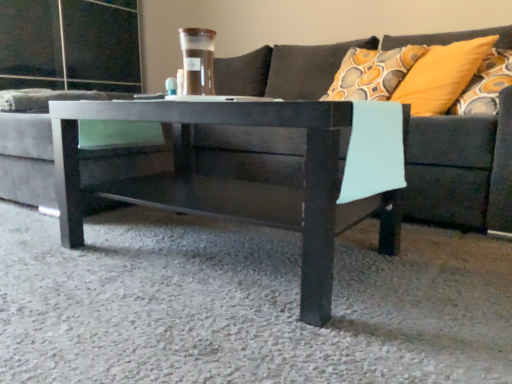
Question: Is yellow fabric pillow at upper right turned away from matte black coffee table at center?

Choices:
 (A) no
 (B) yes

Answer: (A)

Question: Is yellow fabric pillow at upper right further to camera compared to matte black coffee table at center?

Choices:
 (A) yes
 (B) no

Answer: (A)

Question: Can you confirm if yellow fabric pillow at upper right is bigger than matte black coffee table at center?

Choices:
 (A) no
 (B) yes

Answer: (A)

Question: Is yellow fabric pillow at upper right touching matte black coffee table at center?

Choices:
 (A) yes
 (B) no

Answer: (B)

Question: Is yellow fabric pillow at upper right located outside matte black coffee table at center?

Choices:
 (A) no
 (B) yes

Answer: (B)

Question: Considering the positions of matte black coffee table at center and yellow fabric pillow at upper right in the image, is matte black coffee table at center wider or thinner than yellow fabric pillow at upper right?

Choices:
 (A) thin
 (B) wide

Answer: (B)

Question: Is point (315, 127) closer or farther from the camera than point (423, 102)?

Choices:
 (A) closer
 (B) farther

Answer: (A)

Question: Considering the relative positions of matte black coffee table at center and yellow fabric pillow at upper right in the image provided, is matte black coffee table at center to the left or to the right of yellow fabric pillow at upper right?

Choices:
 (A) right
 (B) left

Answer: (B)

Question: Choose the correct answer: Is matte black coffee table at center inside yellow fabric pillow at upper right or outside it?

Choices:
 (A) outside
 (B) inside

Answer: (A)

Question: From their relative heights in the image, would you say yellow fabric pillow at upper right is taller or shorter than dark gray fabric couch at center?

Choices:
 (A) tall
 (B) short

Answer: (B)

Question: From a real-world perspective, is yellow fabric pillow at upper right physically located above or below dark gray fabric couch at center?

Choices:
 (A) below
 (B) above

Answer: (B)

Question: Considering their positions, is yellow fabric pillow at upper right located in front of or behind dark gray fabric couch at center?

Choices:
 (A) front
 (B) behind

Answer: (B)

Question: Is point (415, 97) positioned closer to the camera than point (503, 160)?

Choices:
 (A) closer
 (B) farther

Answer: (B)

Question: In the image, is matte black coffee table at center positioned in front of or behind dark gray fabric couch at center?

Choices:
 (A) behind
 (B) front

Answer: (A)

Question: Is point (248, 221) positioned closer to the camera than point (498, 142)?

Choices:
 (A) farther
 (B) closer

Answer: (B)